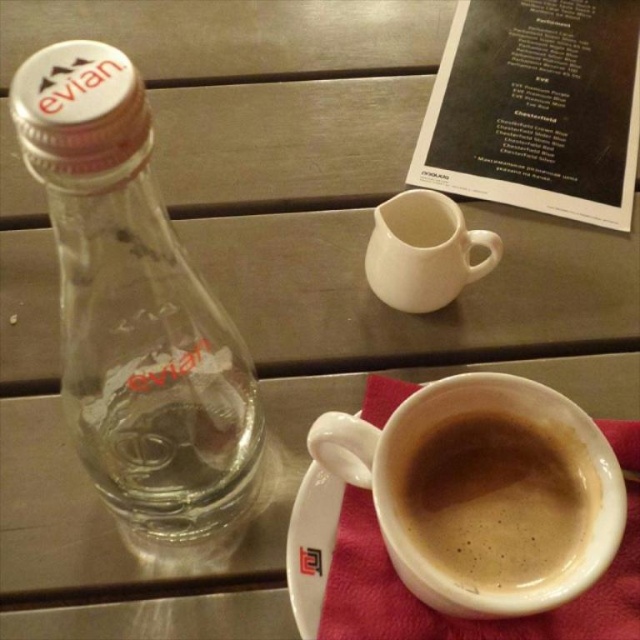
Question: Which point is farther from the camera taking this photo?

Choices:
 (A) (444, 424)
 (B) (460, 269)

Answer: (B)

Question: Which object is the closest to the white ceramic mug at center?

Choices:
 (A) white ceramic mug at lower center
 (B) black paper at upper right
 (C) clear glass bottle at left
 (D) brown matte cup at lower center

Answer: (A)

Question: Is clear glass bottle at left to the right of brown matte cup at lower center from the viewer's perspective?

Choices:
 (A) no
 (B) yes

Answer: (A)

Question: Can you confirm if white ceramic mug at lower center is bigger than white ceramic mug at center?

Choices:
 (A) no
 (B) yes

Answer: (B)

Question: Which object is positioned closest to the black paper at upper right?

Choices:
 (A) white ceramic mug at lower center
 (B) clear glass bottle at left

Answer: (A)

Question: Does brown matte cup at lower center appear on the left side of white ceramic mug at center?

Choices:
 (A) yes
 (B) no

Answer: (B)